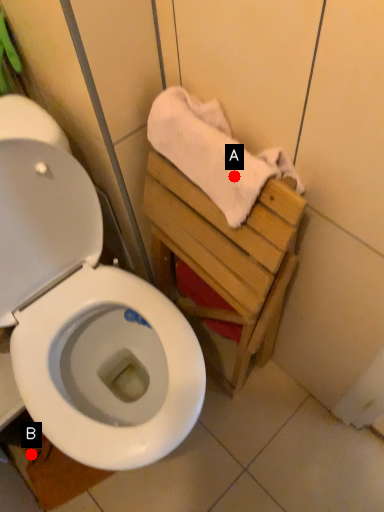
Question: Two points are circled on the image, labeled by A and B beside each circle. Among these points, which one is farthest from the camera?

Choices:
 (A) A is further
 (B) B is further

Answer: (B)